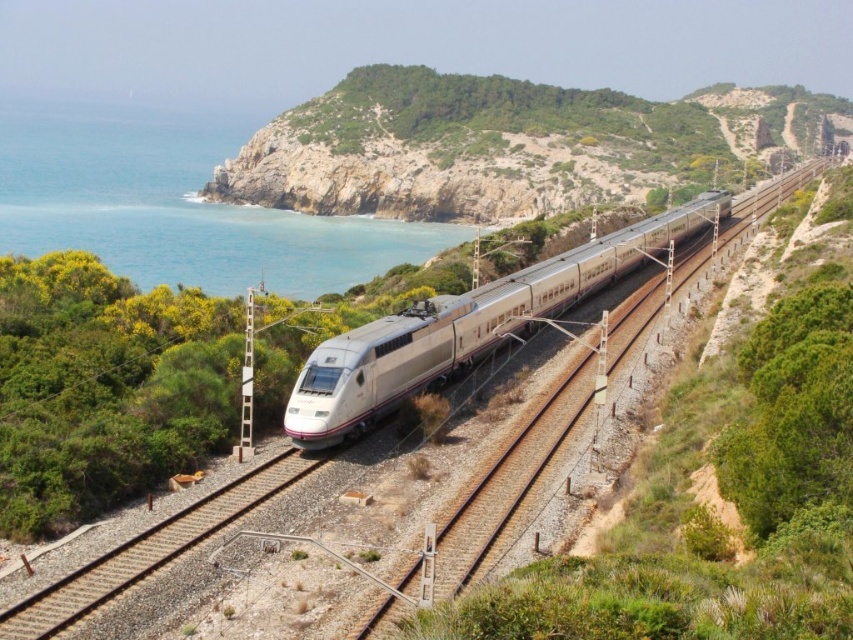
Can you confirm if green grassy hillside at center is positioned below metal/smooth train track at center?

Incorrect, green grassy hillside at center is not positioned below metal/smooth train track at center.

Identify the location of green grassy hillside at center. The width and height of the screenshot is (853, 640). (509, 145).

In order to click on green grassy hillside at center in this screenshot , I will do `click(509, 145)`.

Based on the photo, which of these two, blue water at left or metal/smooth train track at center, stands shorter?

metal/smooth train track at center is shorter.

Based on the photo, does blue water at left have a greater height compared to metal/smooth train track at center?

Indeed, blue water at left has a greater height compared to metal/smooth train track at center.

Who is more distant from viewer, (30, 216) or (88, 572)?

The point (30, 216) is more distant.

The width and height of the screenshot is (853, 640). I want to click on blue water at left, so click(x=177, y=205).

Does silver metallic bullet train at center have a smaller size compared to metal/smooth train track at center?

Actually, silver metallic bullet train at center might be larger than metal/smooth train track at center.

Is silver metallic bullet train at center closer to the viewer compared to metal/smooth train track at center?

That is False.

Describe the element at coordinates (465, 326) in the screenshot. I see `silver metallic bullet train at center` at that location.

Locate an element on the screen. The height and width of the screenshot is (640, 853). silver metallic bullet train at center is located at coordinates (465, 326).